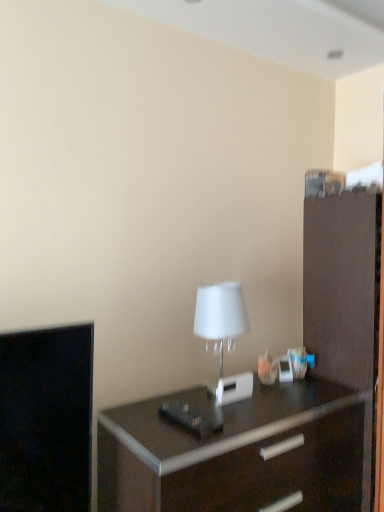
Question: Considering the relative positions of dark wood chest of drawers at center and brown matte file cabinet at right in the image provided, is dark wood chest of drawers at center behind brown matte file cabinet at right?

Choices:
 (A) no
 (B) yes

Answer: (A)

Question: From the image's perspective, is dark wood chest of drawers at center located beneath brown matte file cabinet at right?

Choices:
 (A) no
 (B) yes

Answer: (B)

Question: From a real-world perspective, is dark wood chest of drawers at center over brown matte file cabinet at right?

Choices:
 (A) no
 (B) yes

Answer: (A)

Question: Does dark wood chest of drawers at center have a lesser height compared to brown matte file cabinet at right?

Choices:
 (A) no
 (B) yes

Answer: (B)

Question: Would you say dark wood chest of drawers at center contains brown matte file cabinet at right?

Choices:
 (A) yes
 (B) no

Answer: (B)

Question: Does dark wood chest of drawers at center have a greater height compared to brown matte file cabinet at right?

Choices:
 (A) yes
 (B) no

Answer: (B)

Question: Could you tell me if brown matte file cabinet at right is turned towards white matte table lamp at center?

Choices:
 (A) no
 (B) yes

Answer: (A)

Question: From the image's perspective, would you say brown matte file cabinet at right is positioned over white matte table lamp at center?

Choices:
 (A) yes
 (B) no

Answer: (B)

Question: Is the depth of brown matte file cabinet at right less than that of white matte table lamp at center?

Choices:
 (A) no
 (B) yes

Answer: (A)

Question: Can white matte table lamp at center be found inside brown matte file cabinet at right?

Choices:
 (A) yes
 (B) no

Answer: (B)

Question: From a real-world perspective, does brown matte file cabinet at right sit lower than white matte table lamp at center?

Choices:
 (A) yes
 (B) no

Answer: (A)

Question: Is brown matte file cabinet at right behind white matte table lamp at center?

Choices:
 (A) no
 (B) yes

Answer: (B)

Question: Is dark wood chest of drawers at center smaller than white matte table lamp at center?

Choices:
 (A) no
 (B) yes

Answer: (A)